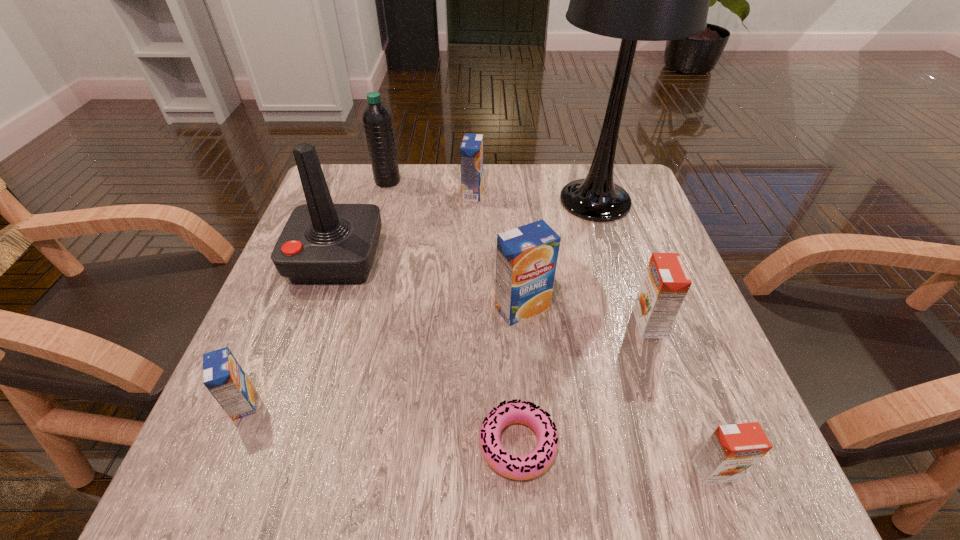
Where is `black table lamp`? The image size is (960, 540). black table lamp is located at coordinates (634, 0).

The width and height of the screenshot is (960, 540). I want to click on the tallest object, so click(x=634, y=0).

Find the location of a particular element. The width and height of the screenshot is (960, 540). joystick is located at coordinates (321, 243).

The height and width of the screenshot is (540, 960). Find the location of `black water bottle`. black water bottle is located at coordinates (377, 119).

Locate an element on the screen. The image size is (960, 540). the third orange juice from right to left is located at coordinates (526, 260).

This screenshot has height=540, width=960. In order to click on the biggest blue orange_juice in this screenshot , I will do `click(526, 260)`.

I want to click on the bigger orange orange juice, so click(x=666, y=282).

Locate an element on the screen. This screenshot has width=960, height=540. the second smallest blue orange_juice is located at coordinates (471, 150).

Where is `the farthest blue orange_juice`? the farthest blue orange_juice is located at coordinates (471, 150).

This screenshot has height=540, width=960. I want to click on the fourth farthest orange juice, so click(222, 375).